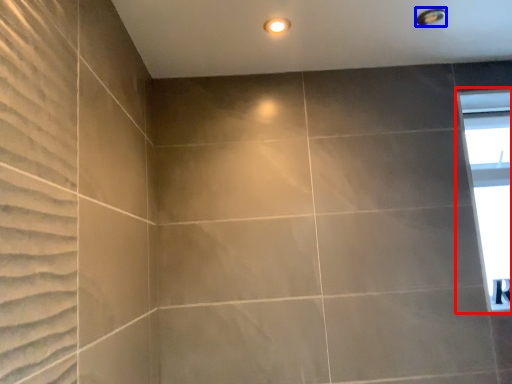
Question: Among these objects, which one is farthest to the camera, window (highlighted by a red box) or shower (highlighted by a blue box)?

Choices:
 (A) window
 (B) shower

Answer: (A)